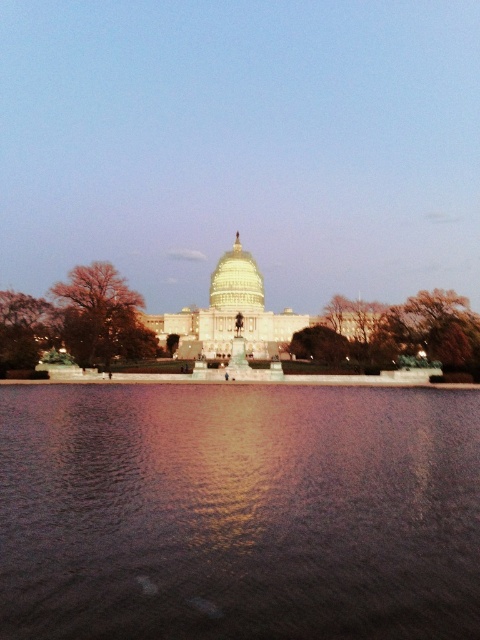
Question: Does glistening reflective water at center have a lesser width compared to gold reflective dome at center?

Choices:
 (A) no
 (B) yes

Answer: (A)

Question: Among these objects, which one is farthest from the camera?

Choices:
 (A) gold reflective dome at center
 (B) brown leafy tree at center
 (C) glistening reflective water at center

Answer: (A)

Question: Is brown textured tree at left behind gold reflective dome at center?

Choices:
 (A) yes
 (B) no

Answer: (B)

Question: Which of the following is the closest to the observer?

Choices:
 (A) (403, 410)
 (B) (144, 301)
 (C) (36, 310)

Answer: (A)

Question: Can you confirm if brown leafy tree at center is thinner than brown textured tree at left?

Choices:
 (A) yes
 (B) no

Answer: (B)

Question: Which of these objects is positioned farthest from the glistening reflective water at center?

Choices:
 (A) gold reflective dome at center
 (B) brown textured tree at left
 (C) brown leafy tree at center
 (D) green leafy tree at left

Answer: (A)